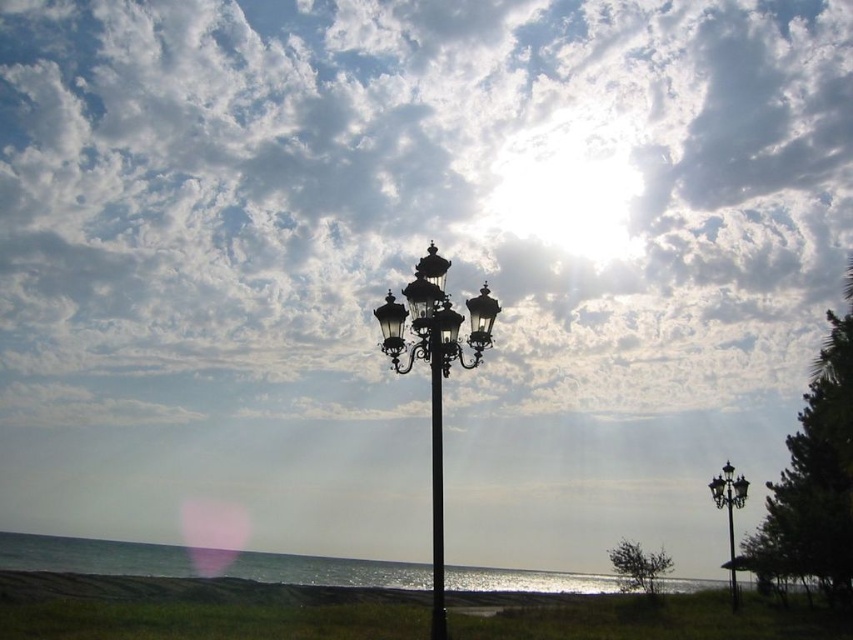
Question: Where is blue water at lower center located in relation to black metal streetlight at right in the image?

Choices:
 (A) left
 (B) right

Answer: (A)

Question: Can you confirm if green grass at lower center is thinner than blue water at lower center?

Choices:
 (A) yes
 (B) no

Answer: (A)

Question: Which point is closer to the camera?

Choices:
 (A) (155, 557)
 (B) (62, 605)
 (C) (440, 566)
 (D) (727, 508)

Answer: (C)

Question: Which is nearer to the blue water at lower center?

Choices:
 (A) black metal streetlight at right
 (B) white fluffy cloud at upper center

Answer: (A)

Question: Is white fluffy cloud at upper center closer to camera compared to black polished metal pole at center?

Choices:
 (A) no
 (B) yes

Answer: (A)

Question: Which of the following is the farthest from the observer?

Choices:
 (A) black metal streetlight at center
 (B) green grass at lower center

Answer: (B)